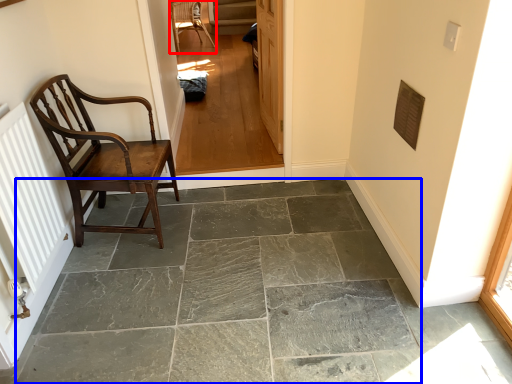
Question: Which of the following is the closest to the observer, chair (highlighted by a red box) or concrete (highlighted by a blue box)?

Choices:
 (A) chair
 (B) concrete

Answer: (B)